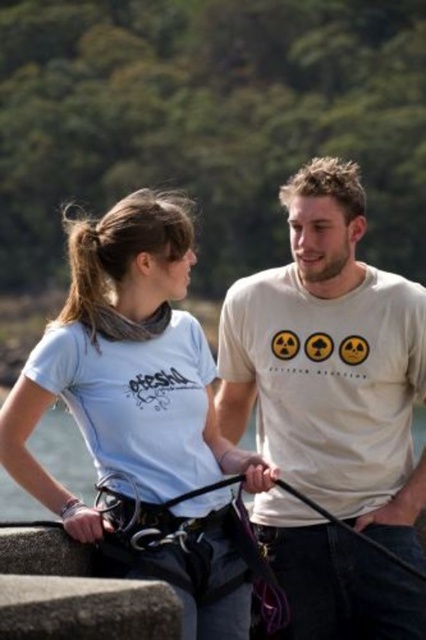
Does white matte t-shirt at center have a smaller size compared to light blue fabric shirt at left?

Correct, white matte t-shirt at center occupies less space than light blue fabric shirt at left.

What do you see at coordinates (331, 362) in the screenshot? The image size is (426, 640). I see `white matte t-shirt at center` at bounding box center [331, 362].

You are a GUI agent. You are given a task and a screenshot of the screen. Output one action in this format:
    pyautogui.click(x=<x>, y=<y>)
    Task: Click on the white matte t-shirt at center
    
    Given the screenshot: What is the action you would take?
    [x=331, y=362]